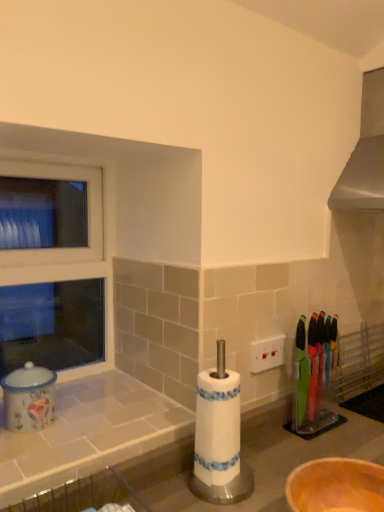
Question: Is translucent plastic knives at right facing towards wooden bowl at lower right?

Choices:
 (A) no
 (B) yes

Answer: (A)

Question: Is translucent plastic knives at right far away from wooden bowl at lower right?

Choices:
 (A) yes
 (B) no

Answer: (B)

Question: Is translucent plastic knives at right outside of wooden bowl at lower right?

Choices:
 (A) yes
 (B) no

Answer: (A)

Question: Is translucent plastic knives at right wider than wooden bowl at lower right?

Choices:
 (A) yes
 (B) no

Answer: (B)

Question: Are translucent plastic knives at right and wooden bowl at lower right making contact?

Choices:
 (A) yes
 (B) no

Answer: (B)

Question: From the image's perspective, does translucent plastic knives at right appear higher than wooden bowl at lower right?

Choices:
 (A) no
 (B) yes

Answer: (B)

Question: Does white tile counter at lower left appear on the right side of translucent plastic knives at right?

Choices:
 (A) no
 (B) yes

Answer: (A)

Question: Is white tile counter at lower left positioned before translucent plastic knives at right?

Choices:
 (A) yes
 (B) no

Answer: (A)

Question: From the image's perspective, is white tile counter at lower left under translucent plastic knives at right?

Choices:
 (A) no
 (B) yes

Answer: (B)

Question: Can you confirm if white tile counter at lower left is smaller than translucent plastic knives at right?

Choices:
 (A) no
 (B) yes

Answer: (A)

Question: Is white tile counter at lower left behind translucent plastic knives at right?

Choices:
 (A) yes
 (B) no

Answer: (B)

Question: Is white tile counter at lower left taller than translucent plastic knives at right?

Choices:
 (A) yes
 (B) no

Answer: (B)

Question: Does matte ceramic coffee canister at left appear on the right side of white tile counter at lower left?

Choices:
 (A) yes
 (B) no

Answer: (B)